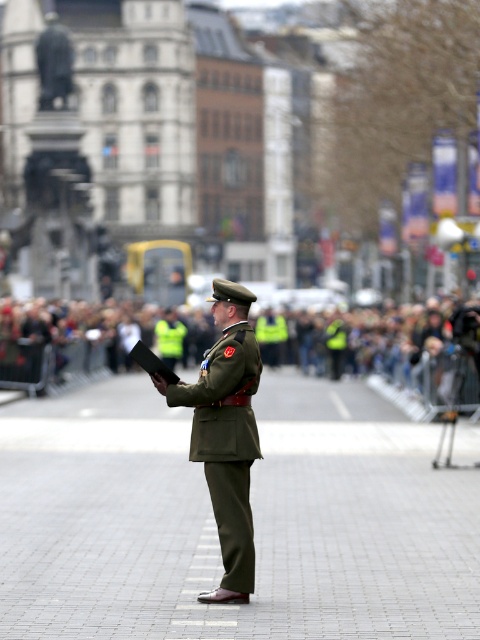
You are a photographer trying to capture a clear shot of both the matte olive green uniform at center and the green matte uniform at center. Since you want to ensure both uniforms are fully visible in the frame, which uniform should you focus on to avoid cropping either?

The matte olive green uniform at center is narrower than the green matte uniform at center. To ensure both are fully visible, focus on the wider green matte uniform at center as the reference point.

In the scene shown: You are a photographer at the event and need to capture both the reflective yellow vests at center and the green matte uniform at center in a single frame. Which object should you focus on to ensure both are visible without zooming in or out?

You should focus on the reflective yellow vests at center because it has a larger size compared to the green matte uniform at center, allowing both to fit within the frame without needing to adjust the zoom.